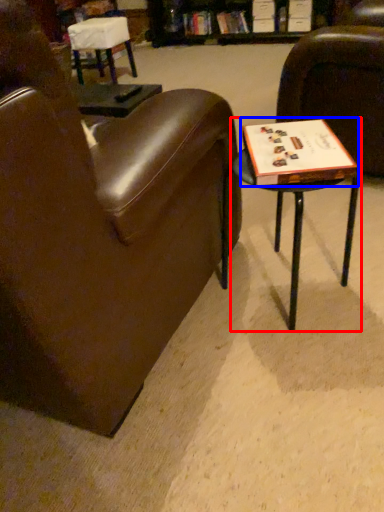
Question: Which point is further to the camera, table (highlighted by a red box) or paperback book (highlighted by a blue box)?

Choices:
 (A) table
 (B) paperback book

Answer: (B)